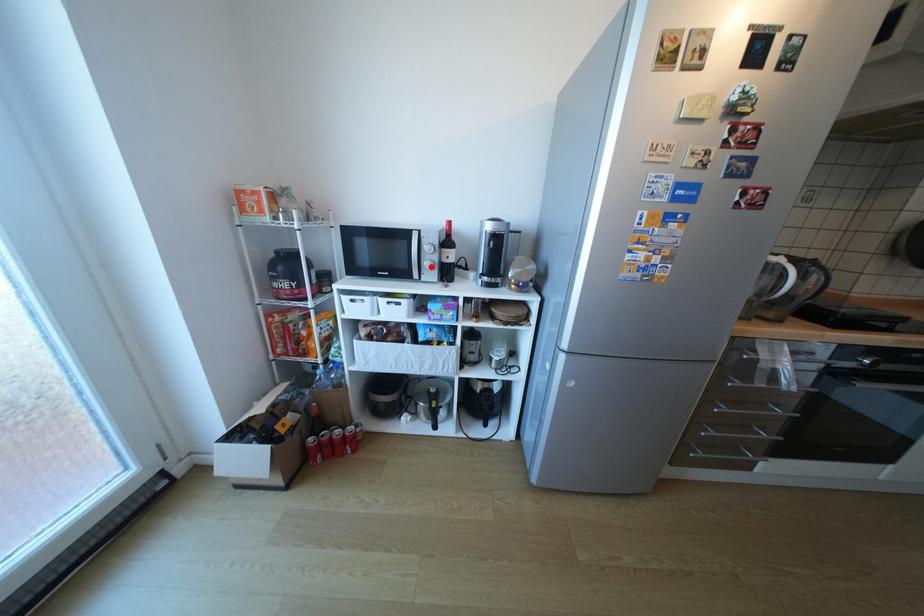
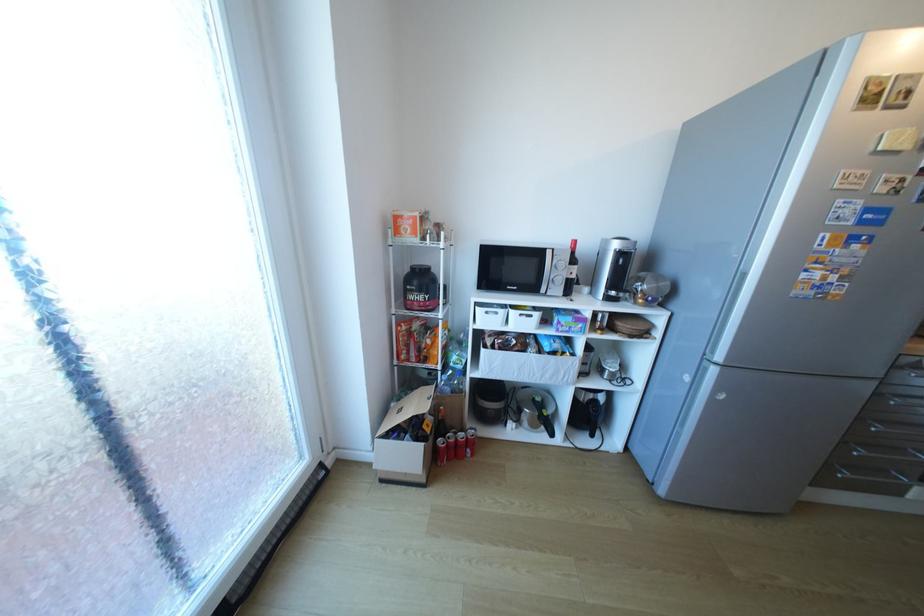
The point at the highlighted location is marked in the first image. Where is the corresponding point in the second image?

(560, 282)